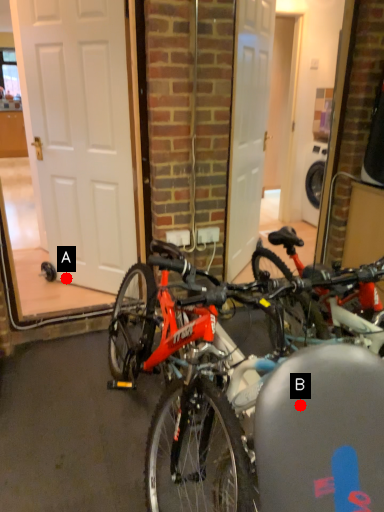
Question: Two points are circled on the image, labeled by A and B beside each circle. Which of the following is the closest to the observer?

Choices:
 (A) A is closer
 (B) B is closer

Answer: (B)